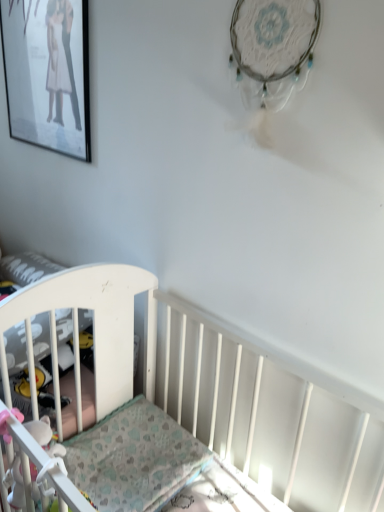
The width and height of the screenshot is (384, 512). Describe the element at coordinates (47, 73) in the screenshot. I see `matte black picture frame at upper left` at that location.

The image size is (384, 512). What do you see at coordinates (134, 458) in the screenshot?
I see `patterned fabric mattress at lower left` at bounding box center [134, 458].

What are the coordinates of `matte black picture frame at upper left` in the screenshot? It's located at (47, 73).

Choose the correct answer: Is patterned fabric mattress at lower left inside white fabric toy at lower left or outside it?

The correct answer is: outside.

From the image's perspective, is patterned fabric mattress at lower left on white fabric toy at lower left?

No, from the image's perspective, patterned fabric mattress at lower left is not on top of white fabric toy at lower left.

Which of these two, patterned fabric mattress at lower left or white fabric toy at lower left, stands shorter?

patterned fabric mattress at lower left is shorter.

Is patterned fabric mattress at lower left at the left side of white fabric toy at lower left?

Yes.

Looking at this image, is matte black picture frame at upper left facing towards white plastic crib at left?

No, matte black picture frame at upper left is not turned towards white plastic crib at left.

Which of these two, matte black picture frame at upper left or white plastic crib at left, is wider?

white plastic crib at left.

Is matte black picture frame at upper left taller or shorter than white plastic crib at left?

In the image, matte black picture frame at upper left appears to be taller than white plastic crib at left.

Who is smaller, matte black picture frame at upper left or white plastic crib at left?

matte black picture frame at upper left is smaller.

Is white fabric toy at lower left with white plastic crib at left?

No, white fabric toy at lower left is not beside white plastic crib at left.

From the image's perspective, which is below, white fabric toy at lower left or white plastic crib at left?

white fabric toy at lower left.

Between white fabric toy at lower left and white plastic crib at left, which one appears on the right side from the viewer's perspective?

From the viewer's perspective, white fabric toy at lower left appears more on the right side.

Which is closer to the camera, (x=25, y=433) or (x=17, y=292)?

The point (x=25, y=433) is closer to the camera.

Between white plastic crib at left and matte black picture frame at upper left, which one appears on the left side from the viewer's perspective?

white plastic crib at left.

Would you say white plastic crib at left is a long distance from matte black picture frame at upper left?

They are positioned close to each other.

Which is in front, point (130, 345) or point (43, 82)?

Point (130, 345)

From the image's perspective, does white plastic crib at left appear lower than matte black picture frame at upper left?

Yes.

Between matte black picture frame at upper left and patterned fabric mattress at lower left, which one has smaller width?

Thinner between the two is matte black picture frame at upper left.

From a real-world perspective, is matte black picture frame at upper left physically below patterned fabric mattress at lower left?

Actually, matte black picture frame at upper left is physically above patterned fabric mattress at lower left in the real world.

This screenshot has width=384, height=512. I want to click on mattress behind the white fabric toy at lower left, so click(134, 458).

From a real-world perspective, which object stands above the other?

In real-world perspective, white fabric toy at lower left is above.

Is white fabric toy at lower left located outside patterned fabric mattress at lower left?

That's correct, white fabric toy at lower left is outside of patterned fabric mattress at lower left.

Is point (13, 437) positioned behind point (123, 448)?

No.

Considering the sizes of objects white plastic crib at left and white fabric toy at lower left in the image provided, who is taller, white plastic crib at left or white fabric toy at lower left?

white fabric toy at lower left is taller.

Between white plastic crib at left and white fabric toy at lower left, which one has larger size?

white plastic crib at left is bigger.

Are white plastic crib at left and white fabric toy at lower left located far from each other?

No.

From the image's perspective, between white plastic crib at left and white fabric toy at lower left, which one is located above?

white plastic crib at left.

The image size is (384, 512). Find the location of `mattress below the white fabric toy at lower left (from the image's perspective)`. mattress below the white fabric toy at lower left (from the image's perspective) is located at coordinates (134, 458).

This screenshot has height=512, width=384. I want to click on picture frame above the white plastic crib at left (from a real-world perspective), so click(47, 73).

Looking at the image, which one is located closer to white fabric toy at lower left, patterned fabric mattress at lower left or white plastic crib at left?

patterned fabric mattress at lower left.

Based on their spatial positions, is white plastic crib at left or matte black picture frame at upper left closer to patterned fabric mattress at lower left?

white plastic crib at left.

Based on their spatial positions, is white fabric toy at lower left or matte black picture frame at upper left further from white plastic crib at left?

Based on the image, matte black picture frame at upper left appears to be further to white plastic crib at left.

When comparing their distances from white plastic crib at left, does patterned fabric mattress at lower left or white fabric toy at lower left seem further?

The object further to white plastic crib at left is white fabric toy at lower left.

Estimate the real-world distances between objects in this image. Which object is further from matte black picture frame at upper left, patterned fabric mattress at lower left or white fabric toy at lower left?

white fabric toy at lower left is positioned further to the anchor matte black picture frame at upper left.

Considering their positions, is white plastic crib at left positioned closer to patterned fabric mattress at lower left than white fabric toy at lower left?

white plastic crib at left.

Estimate the real-world distances between objects in this image. Which object is further from white fabric toy at lower left, matte black picture frame at upper left or white plastic crib at left?

matte black picture frame at upper left is further to white fabric toy at lower left.

Which object lies nearer to the anchor point white fabric toy at lower left, patterned fabric mattress at lower left or matte black picture frame at upper left?

patterned fabric mattress at lower left is closer to white fabric toy at lower left.

Locate an element on the screen. The height and width of the screenshot is (512, 384). toy between matte black picture frame at upper left and patterned fabric mattress at lower left from top to bottom is located at coordinates (26, 452).

Image resolution: width=384 pixels, height=512 pixels. I want to click on infant bed between matte black picture frame at upper left and patterned fabric mattress at lower left in the up-down direction, so click(x=93, y=332).

This screenshot has width=384, height=512. I want to click on infant bed between matte black picture frame at upper left and white fabric toy at lower left in the up-down direction, so click(93, 332).

Where is `toy between white plastic crib at left and patterned fabric mattress at lower left in the vertical direction`? toy between white plastic crib at left and patterned fabric mattress at lower left in the vertical direction is located at coordinates (26, 452).